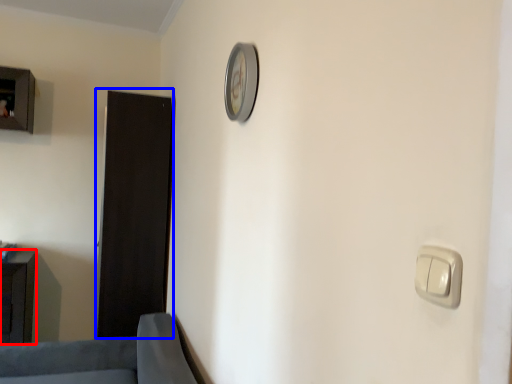
Question: Which object is closer to the camera taking this photo, furniture (highlighted by a red box) or door (highlighted by a blue box)?

Choices:
 (A) furniture
 (B) door

Answer: (A)